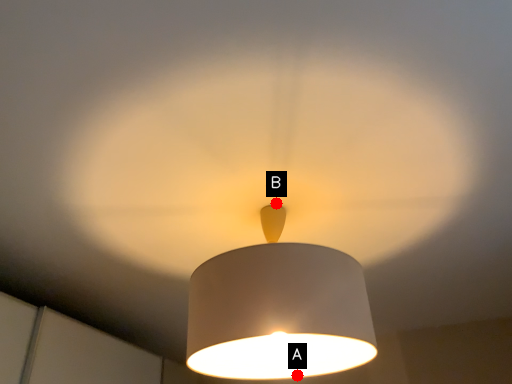
Question: Two points are circled on the image, labeled by A and B beside each circle. Among these points, which one is nearest to the camera?

Choices:
 (A) A is closer
 (B) B is closer

Answer: (B)